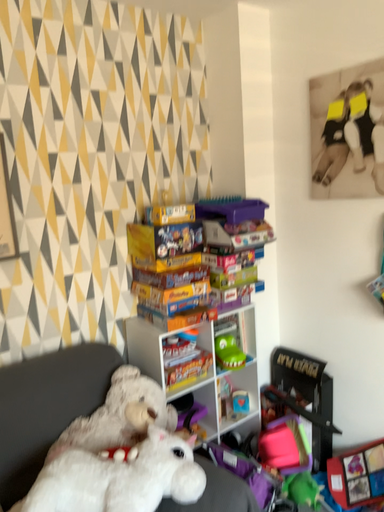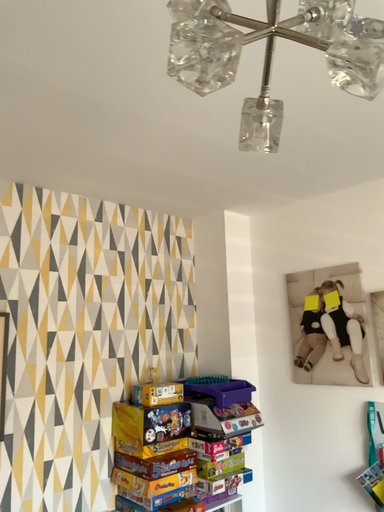
Question: How did the camera likely rotate when shooting the video?

Choices:
 (A) rotated upward
 (B) rotated downward

Answer: (A)